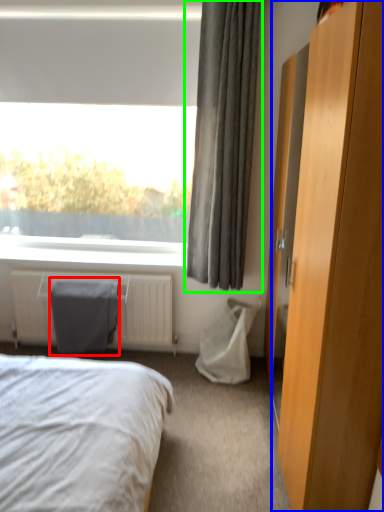
Question: Based on their relative distances, which object is nearer to gray (highlighted by a red box)? Choose from dresser (highlighted by a blue box) and curtain (highlighted by a green box).

Choices:
 (A) dresser
 (B) curtain

Answer: (B)